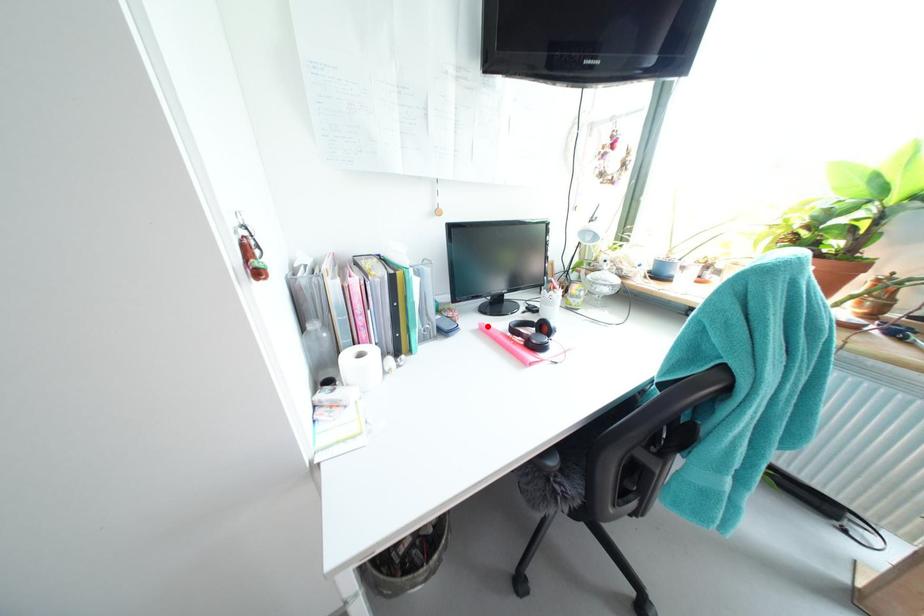
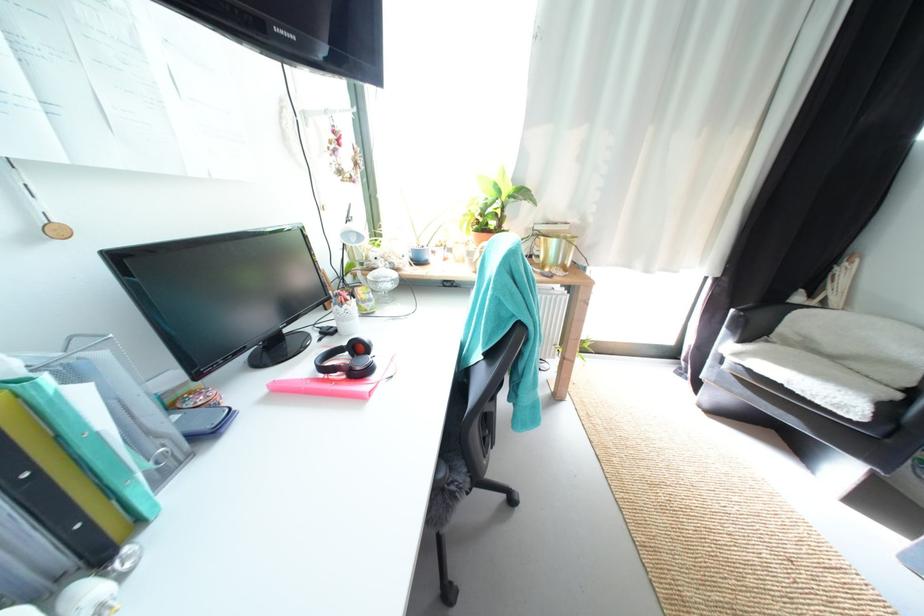
Find the pixel in the second image that matches the highlighted location in the first image.

(275, 387)